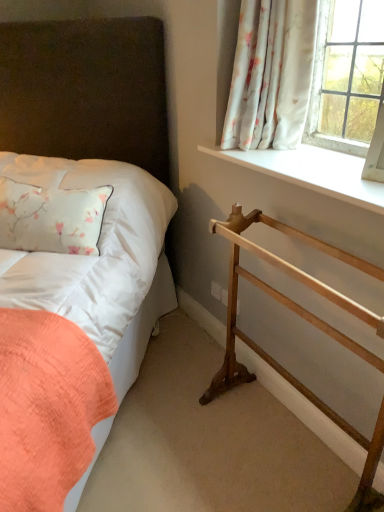
Find the location of a particular element. vacant space situated above white smooth window sill at upper right (from a real-world perspective) is located at coordinates (313, 160).